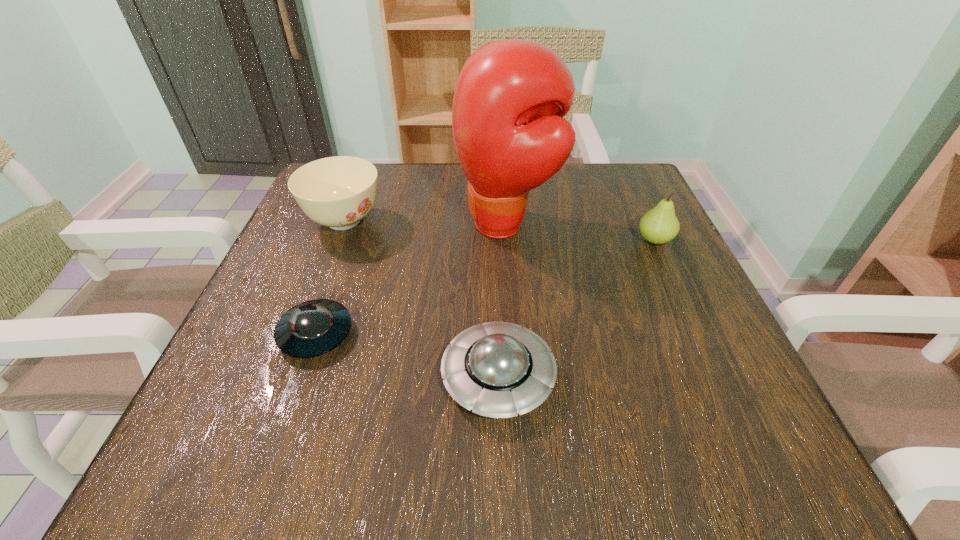
Locate an element on the screen. object that is at the far left corner is located at coordinates (338, 192).

Locate an element on the screen. vacant area at the far edge of the desktop is located at coordinates (452, 193).

Image resolution: width=960 pixels, height=540 pixels. What are the coordinates of `vacant space at the left edge of the desktop` in the screenshot? It's located at (241, 348).

Identify the location of vacant area at the right edge. This screenshot has width=960, height=540. (651, 308).

Image resolution: width=960 pixels, height=540 pixels. In order to click on free space at the near left corner in this screenshot , I will do `click(227, 442)`.

Where is `blank area at the far right corner`? This screenshot has width=960, height=540. blank area at the far right corner is located at coordinates (x=632, y=185).

Identify the location of vacant space at the near right corner. (756, 476).

Identify the location of empty space between the boxing glove and the right saucer. (502, 301).

Identify the location of unoccupied area between the boxing glove and the sugar bowl. point(425,223).

Locate an element on the screen. Image resolution: width=960 pixels, height=540 pixels. free spot between the left saucer and the boxing glove is located at coordinates (411, 279).